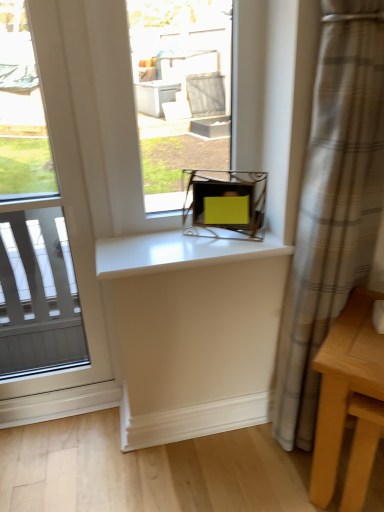
At what (x,y) coordinates should I click in order to perform the action: click on free space above light wood table at lower right (from a real-world perspective). Please return your answer as a coordinate pair (x, y). Image resolution: width=384 pixels, height=512 pixels. Looking at the image, I should click on (360, 323).